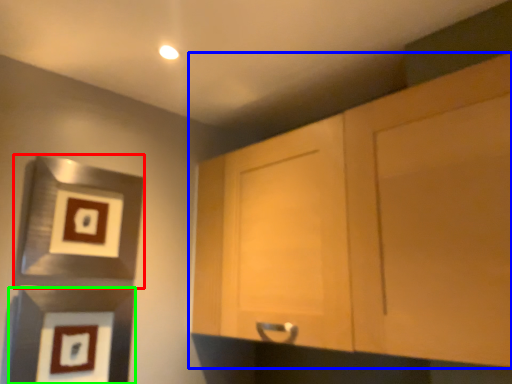
Question: Which is farther away from picture frame (highlighted by a red box)? cabinetry (highlighted by a blue box) or picture frame (highlighted by a green box)?

Choices:
 (A) cabinetry
 (B) picture frame

Answer: (A)